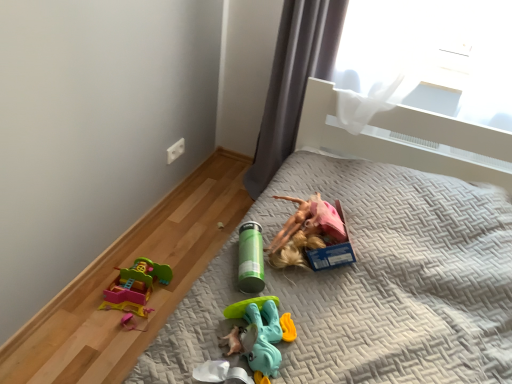
Question: From the image's perspective, is gray fabric curtain at upper right located above or below gray quilted bed at center?

Choices:
 (A) above
 (B) below

Answer: (A)

Question: Considering their positions, is gray fabric curtain at upper right located in front of or behind gray quilted bed at center?

Choices:
 (A) behind
 (B) front

Answer: (A)

Question: Considering the real-world distances, which object is farthest from the translucent plastic toy at center, acting as the first toy starting from the bottom?

Choices:
 (A) gray quilted bed at center
 (B) gray fabric curtain at upper right
 (C) green matte thermos at center, the first toy viewed from the back

Answer: (B)

Question: Which object is positioned closest to the translucent plastic toy at center, acting as the second toy starting from the top?

Choices:
 (A) gray fabric curtain at upper right
 (B) gray quilted bed at center
 (C) green matte thermos at center, the second toy when ordered from front to back

Answer: (C)